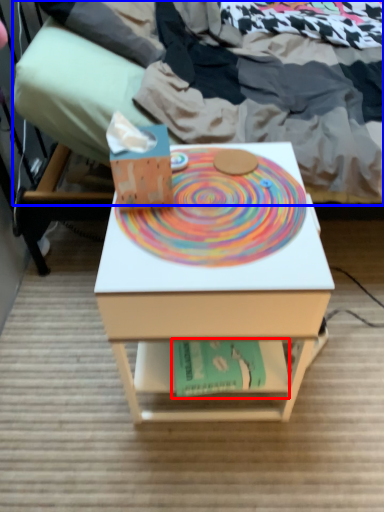
Question: Which point is further to the camera, paperback book (highlighted by a red box) or bed (highlighted by a blue box)?

Choices:
 (A) paperback book
 (B) bed

Answer: (A)